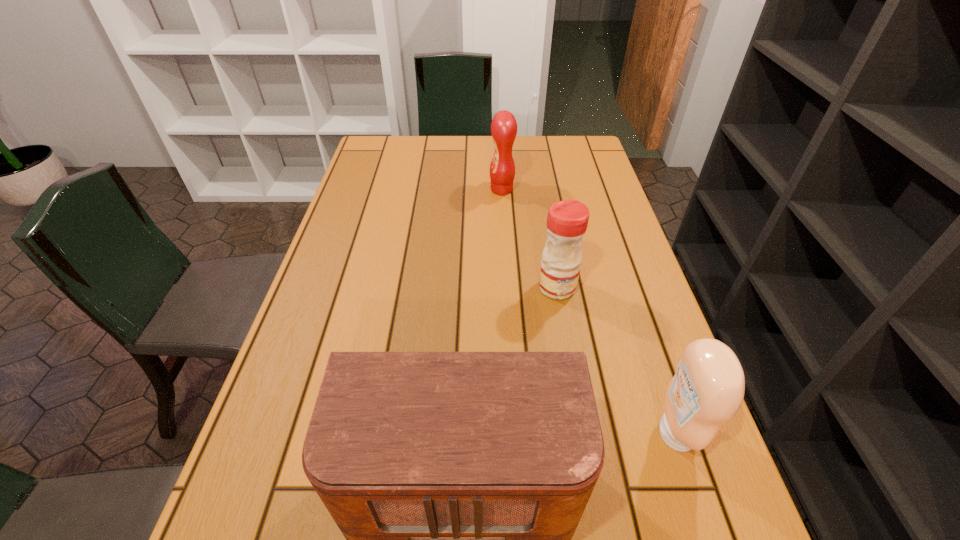
At what (x,y) coordinates should I click in order to perform the action: click on vacant space that satisfies the following two spatial constraints: 1. on the label side of the farthest condiment; 2. on the back side of the second condiment from right to left. Please return your answer as a coordinate pair (x, y). The height and width of the screenshot is (540, 960). Looking at the image, I should click on (508, 287).

Locate an element on the screen. This screenshot has width=960, height=540. free location that satisfies the following two spatial constraints: 1. on the label side of the farthest condiment; 2. on the back side of the second nearest condiment is located at coordinates (508, 287).